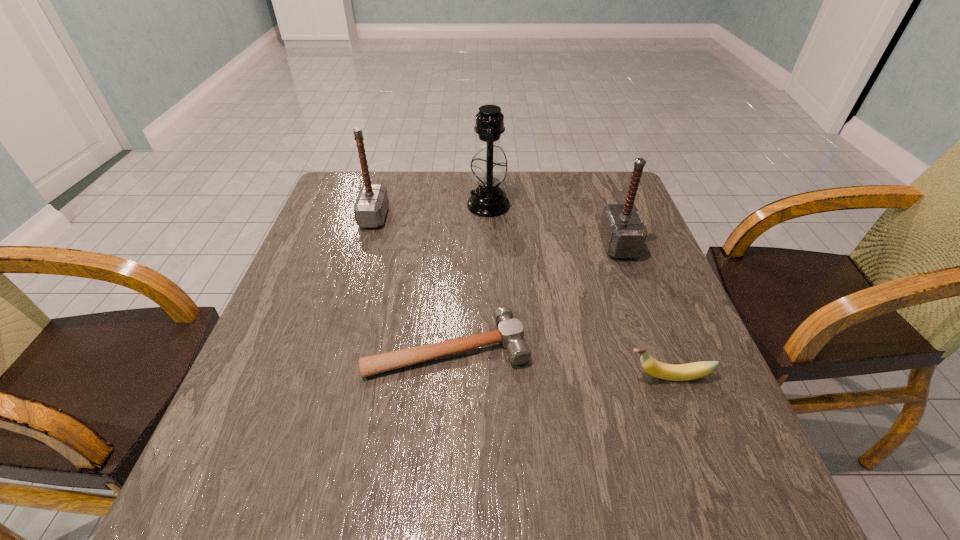
Identify the location of oil lamp. (488, 167).

Where is `the leftmost object`? Image resolution: width=960 pixels, height=540 pixels. the leftmost object is located at coordinates (370, 208).

Identify the location of the rightmost hammer. The width and height of the screenshot is (960, 540). (623, 232).

I want to click on the second shortest object, so click(x=683, y=372).

Locate an element on the screen. The width and height of the screenshot is (960, 540). the second hammer from left to right is located at coordinates point(510,333).

This screenshot has width=960, height=540. Identify the location of the nearest hammer. (510, 333).

Locate an element on the screen. This screenshot has width=960, height=540. free space located on the left of the oil lamp is located at coordinates (433, 205).

At what (x,y) coordinates should I click in order to perform the action: click on free space located on the striking surface of the leftmost object. Please return your answer as a coordinate pair (x, y). Looking at the image, I should click on (429, 217).

You are a GUI agent. You are given a task and a screenshot of the screen. Output one action in this format:
    pyautogui.click(x=<x>, y=<y>)
    Task: Click on the free space located 0.120m on the front of the rightmost hammer
    The width and height of the screenshot is (960, 540).
    Given the screenshot: What is the action you would take?
    pyautogui.click(x=636, y=296)

The height and width of the screenshot is (540, 960). Find the location of `vacant space located 0.160m at the stem of the banana`. vacant space located 0.160m at the stem of the banana is located at coordinates pyautogui.click(x=541, y=376).